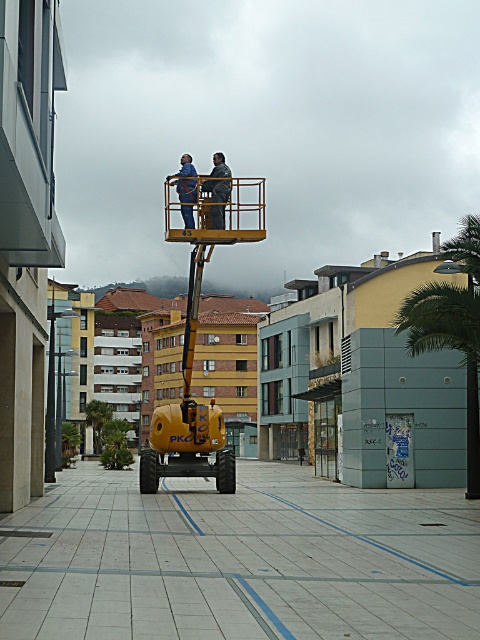
Can you confirm if yellow metallic forklift at center is positioned to the left of green leafy palm tree at right?

Indeed, yellow metallic forklift at center is positioned on the left side of green leafy palm tree at right.

Does point (191, 461) lie behind point (456, 348)?

Yes, it is behind point (456, 348).

Is point (192, 476) behind point (445, 269)?

Yes.

You are a GUI agent. You are given a task and a screenshot of the screen. Output one action in this format:
    pyautogui.click(x=<x>, y=<y>)
    Task: Click on the yellow metallic forklift at center
    The height and width of the screenshot is (640, 480).
    Given the screenshot: What is the action you would take?
    pyautogui.click(x=193, y=349)

Is point (80, 550) positioned after point (428, 289)?

No, (80, 550) is closer to viewer.

Can you confirm if yellow rubber construction vehicle at center is smaller than green leafy palm tree at right?

Actually, yellow rubber construction vehicle at center might be larger than green leafy palm tree at right.

The width and height of the screenshot is (480, 640). Describe the element at coordinates (240, 560) in the screenshot. I see `yellow rubber construction vehicle at center` at that location.

Identify the location of yellow rubber construction vehicle at center. (240, 560).

Which is more to the right, yellow rubber construction vehicle at center or green leafy palm tree at center?

yellow rubber construction vehicle at center

Who is higher up, yellow rubber construction vehicle at center or green leafy palm tree at center?

yellow rubber construction vehicle at center

The height and width of the screenshot is (640, 480). Find the location of `yellow rubber construction vehicle at center`. yellow rubber construction vehicle at center is located at coordinates (240, 560).

Locate an element on the screen. yellow rubber construction vehicle at center is located at coordinates (240, 560).